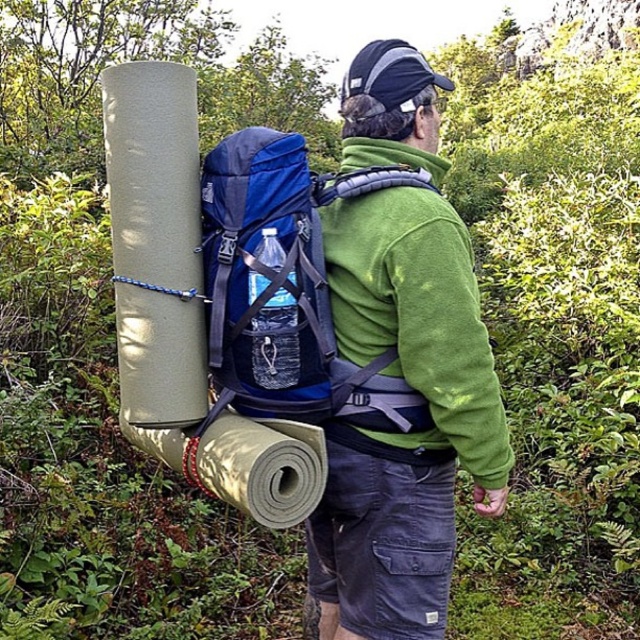
Between blue fabric backpack at center and green fleece jacket at back, which one has less height?

With less height is blue fabric backpack at center.

Which is more to the right, blue fabric backpack at center or green fleece jacket at back?

green fleece jacket at back

The height and width of the screenshot is (640, 640). In order to click on blue fabric backpack at center in this screenshot , I will do `click(285, 288)`.